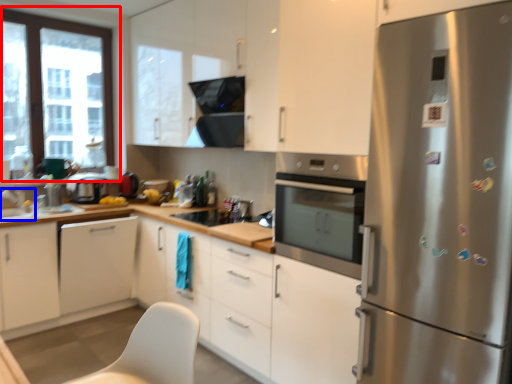
Question: Which object is further to the camera taking this photo, window (highlighted by a red box) or sink (highlighted by a blue box)?

Choices:
 (A) window
 (B) sink

Answer: (A)